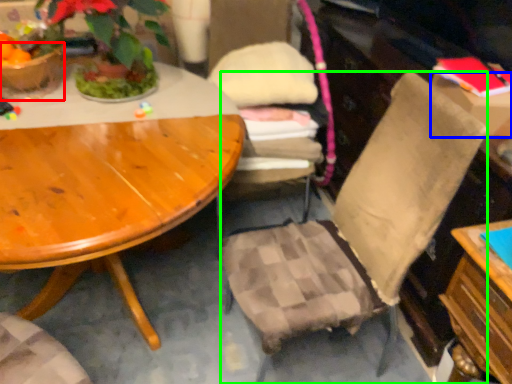
Question: Based on their relative distances, which object is farther from flowerpot (highlighted by a red box)? Choose from box (highlighted by a blue box) and chair (highlighted by a green box).

Choices:
 (A) box
 (B) chair

Answer: (A)